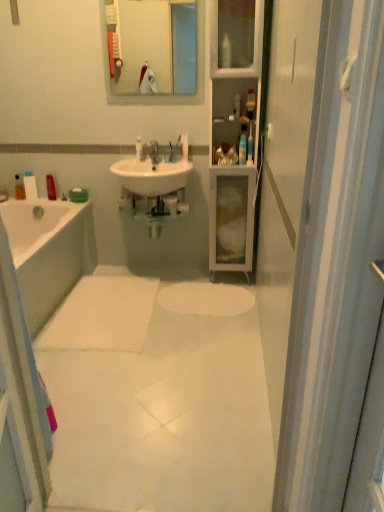
Question: Is white matte soap bar at left, the 3th toiletry viewed from the back, looking in the opposite direction of translucent plastic bottle at left, positioned as the sixth toiletry in front-to-back order?

Choices:
 (A) no
 (B) yes

Answer: (A)

Question: From the image's perspective, is white matte soap bar at left, marked as the 4th toiletry in a front-to-back arrangement, on top of translucent plastic bottle at left, positioned as the sixth toiletry in front-to-back order?

Choices:
 (A) no
 (B) yes

Answer: (B)

Question: Is white matte soap bar at left, which ranks as the fifth toiletry in right-to-left order, aimed at translucent plastic bottle at left, the first toiletry in the left-to-right sequence?

Choices:
 (A) yes
 (B) no

Answer: (B)

Question: Is white matte soap bar at left, which is the 2th toiletry in left-to-right order, further to the viewer compared to translucent plastic bottle at left, the first toiletry in the left-to-right sequence?

Choices:
 (A) no
 (B) yes

Answer: (A)

Question: Can you confirm if white matte soap bar at left, marked as the 4th toiletry in a front-to-back arrangement, is positioned to the right of translucent plastic bottle at left, the first toiletry from the back?

Choices:
 (A) no
 (B) yes

Answer: (B)

Question: From the image's perspective, is white matte soap bar at left, which ranks as the fifth toiletry in right-to-left order, located beneath translucent plastic bottle at left, the first toiletry from the back?

Choices:
 (A) yes
 (B) no

Answer: (B)

Question: Does matte plastic bottle at left, positioned as the third toiletry in left-to-right order, have a greater height compared to white plastic toothbrush at upper center, the third toiletry viewed from the front?

Choices:
 (A) no
 (B) yes

Answer: (B)

Question: Can you confirm if matte plastic bottle at left, positioned as the third toiletry in left-to-right order, is positioned to the left of white plastic toothbrush at upper center, which ranks as the 4th toiletry in left-to-right order?

Choices:
 (A) yes
 (B) no

Answer: (A)

Question: Does matte plastic bottle at left, the second toiletry in the back-to-front sequence, have a greater width compared to white plastic toothbrush at upper center, the fourth toiletry when ordered from back to front?

Choices:
 (A) yes
 (B) no

Answer: (A)

Question: Is matte plastic bottle at left, positioned as the third toiletry in left-to-right order, smaller than white plastic toothbrush at upper center, the third toiletry viewed from the right?

Choices:
 (A) yes
 (B) no

Answer: (B)

Question: From a real-world perspective, does matte plastic bottle at left, positioned as the third toiletry in left-to-right order, sit lower than white plastic toothbrush at upper center, the third toiletry viewed from the front?

Choices:
 (A) no
 (B) yes

Answer: (B)

Question: Is white plastic toothbrush at upper center, the third toiletry viewed from the right, inside matte plastic bottle at left, positioned as the third toiletry in left-to-right order?

Choices:
 (A) no
 (B) yes

Answer: (A)

Question: Is white smooth mat at center oriented towards matte plastic bottle at left, the second toiletry in the back-to-front sequence?

Choices:
 (A) no
 (B) yes

Answer: (A)